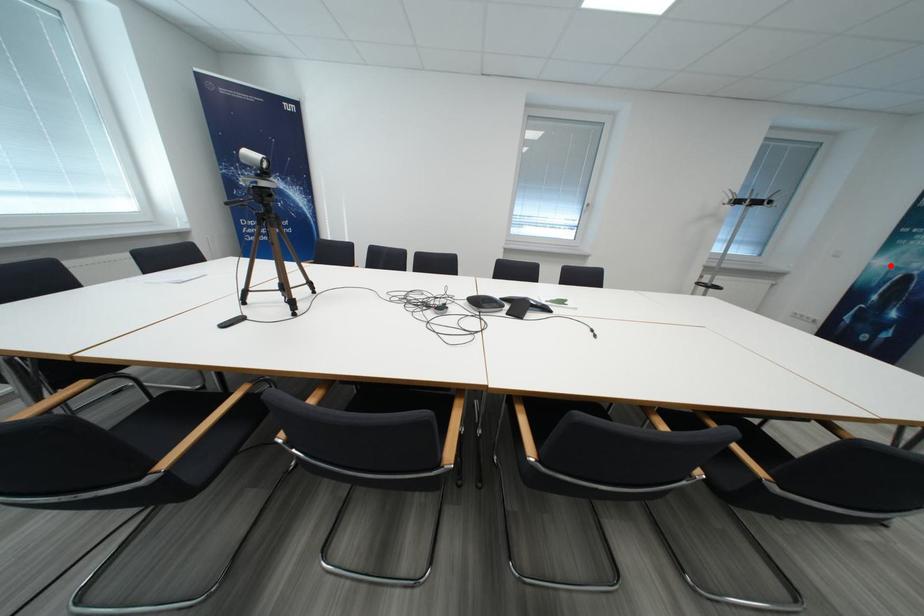
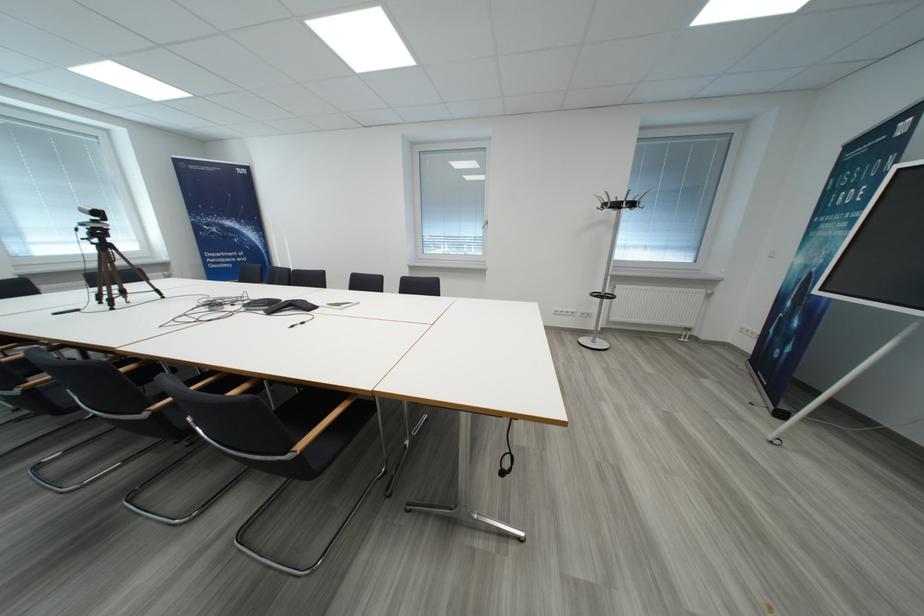
Question: I am providing you with two images of the same scene from different viewpoints. Given a red point in image1, look at the same physical point in image2. Is it:

Choices:
 (A) Closer to the viewpoint
 (B) Farther from the viewpoint

Answer: (A)